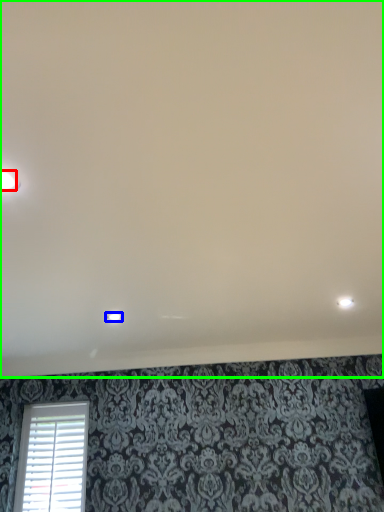
Question: Based on their relative distances, which object is farther from dot (highlighted by a red box)? Choose from dot (highlighted by a blue box) and backdrop (highlighted by a green box).

Choices:
 (A) dot
 (B) backdrop

Answer: (A)